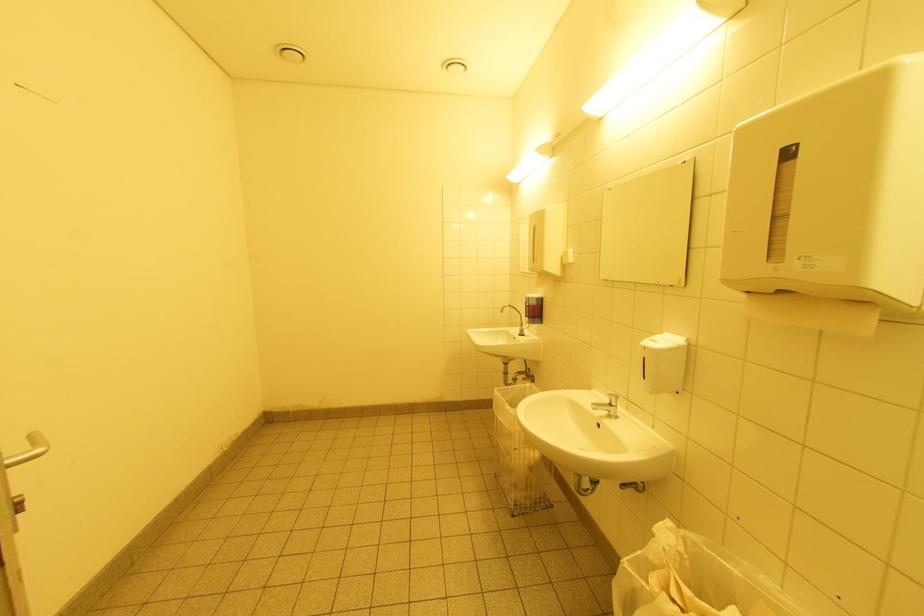
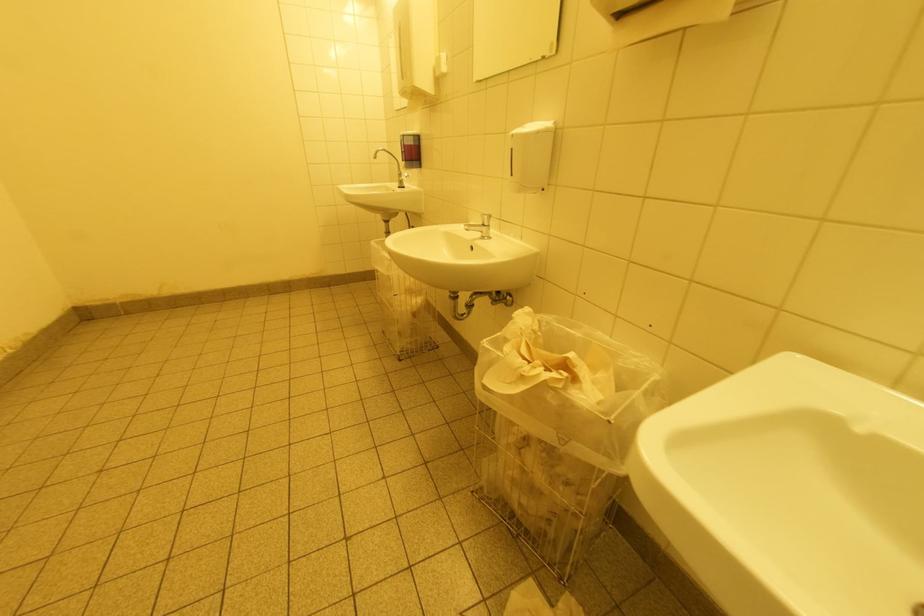
Based on the continuous images, in which direction is the camera rotating?

The rotation direction of the camera is right-down.